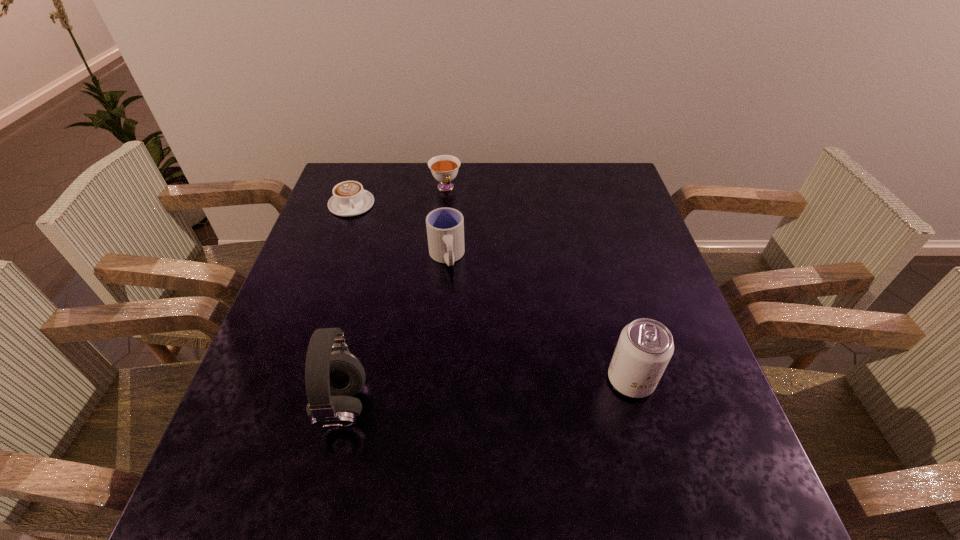
Locate an element on the screen. The image size is (960, 540). vacant space located on the left of the second tallest object is located at coordinates (572, 380).

The width and height of the screenshot is (960, 540). Find the location of `vacant area located with the handle on the side of the third tallest object`. vacant area located with the handle on the side of the third tallest object is located at coordinates (464, 406).

In order to click on free location located 0.110m with the handle on the side of the third tallest object in this screenshot , I will do `click(452, 308)`.

Where is `blank area located with the handle on the side of the third tallest object`? This screenshot has width=960, height=540. blank area located with the handle on the side of the third tallest object is located at coordinates (x=452, y=315).

Locate an element on the screen. This screenshot has height=540, width=960. free space located on the side of the teacup with the handle is located at coordinates (470, 261).

The height and width of the screenshot is (540, 960). Find the location of `free spot located on the side of the teacup with the handle`. free spot located on the side of the teacup with the handle is located at coordinates (458, 224).

Where is `vacant region located on the side of the teacup with the handle`? The width and height of the screenshot is (960, 540). vacant region located on the side of the teacup with the handle is located at coordinates (472, 266).

Find the location of a particular element. The height and width of the screenshot is (540, 960). vacant area located 0.370m with the handle on the right side of the cappuccino is located at coordinates (403, 301).

Locate an element on the screen. The width and height of the screenshot is (960, 540). vacant region located with the handle on the right side of the cappuccino is located at coordinates (399, 293).

Find the location of a particular element. free location located with the handle on the right side of the cappuccino is located at coordinates (378, 253).